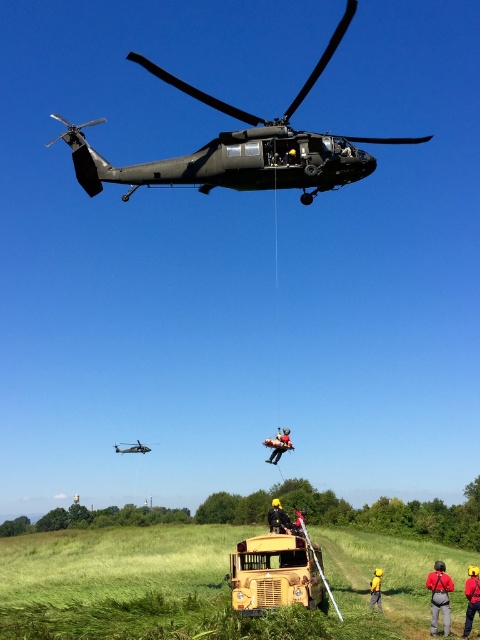
You are a safety inspector assessing the scene. You notice the yellow matte school bus at center and the yellow hard hat at center. Which object is bigger in size?

The yellow matte school bus at center is larger in size compared to the yellow hard hat at center.

You are a construction worker who just arrived at the site. You see the yellow matte school bus at center and the yellow hard hat at center. Which object is higher up in the image?

The yellow matte school bus at center is above the yellow hard hat at center, so the school bus is higher up in the image.

You are a delivery person who needs to place a large package next to the yellow matte school bus at center and the red fabric backpack at lower right. Which object requires more horizontal space for the package?

The yellow matte school bus at center requires more horizontal space for the package since it is wider than the red fabric backpack at lower right.